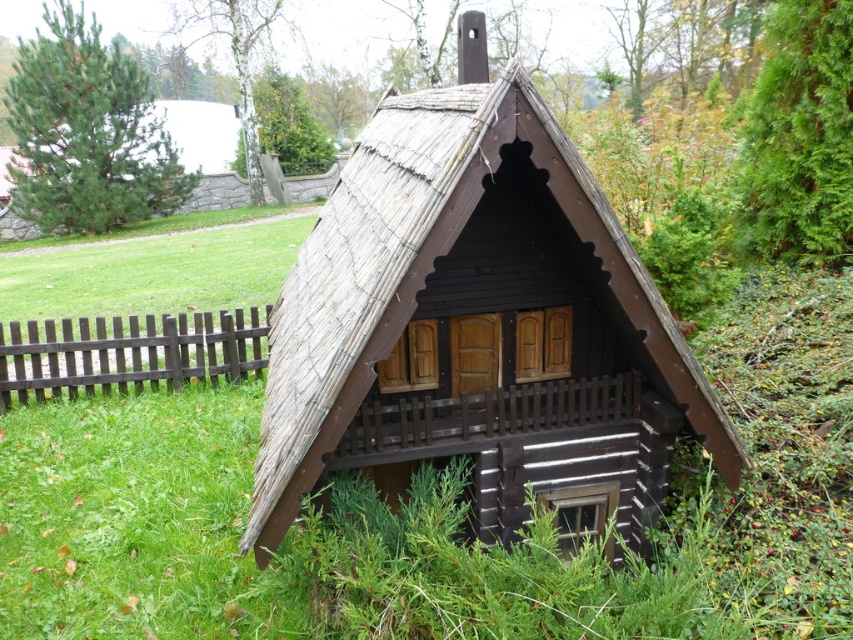
Question: Is the position of matte black cabin at center more distant than that of brown wooden fence at lower left?

Choices:
 (A) yes
 (B) no

Answer: (B)

Question: Which object is closer to the camera taking this photo?

Choices:
 (A) green grass at center
 (B) brown wooden fence at lower left

Answer: (A)

Question: Which of the following is the closest to the observer?

Choices:
 (A) brown wooden fence at lower left
 (B) green grass at center

Answer: (B)

Question: Which point appears closest to the camera in this image?

Choices:
 (A) (358, 250)
 (B) (694, 515)

Answer: (A)

Question: Does green grass at center have a smaller size compared to brown wooden fence at lower left?

Choices:
 (A) no
 (B) yes

Answer: (A)

Question: Is matte black cabin at center thinner than brown wooden fence at lower left?

Choices:
 (A) no
 (B) yes

Answer: (A)